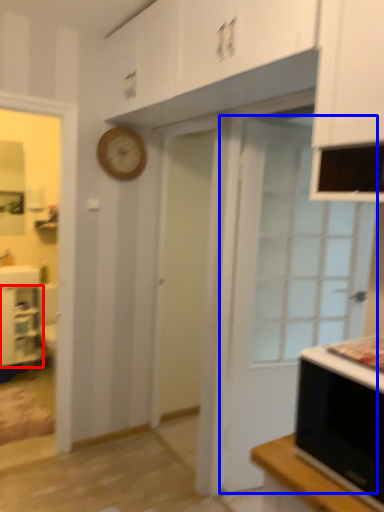
Question: Which object appears farthest to the camera in this image, cabinetry (highlighted by a red box) or door (highlighted by a blue box)?

Choices:
 (A) cabinetry
 (B) door

Answer: (A)